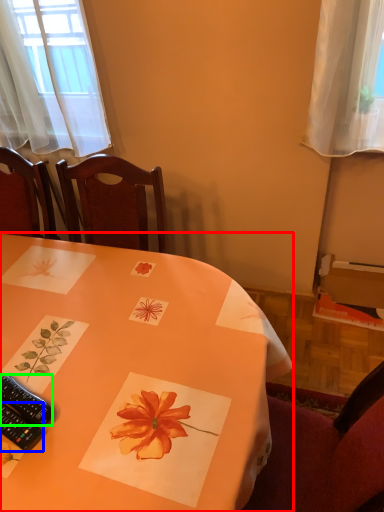
Question: Based on their relative distances, which object is farther from table (highlighted by a red box)? Choose from remote control (highlighted by a blue box) and remote control (highlighted by a green box).

Choices:
 (A) remote control
 (B) remote control

Answer: (A)